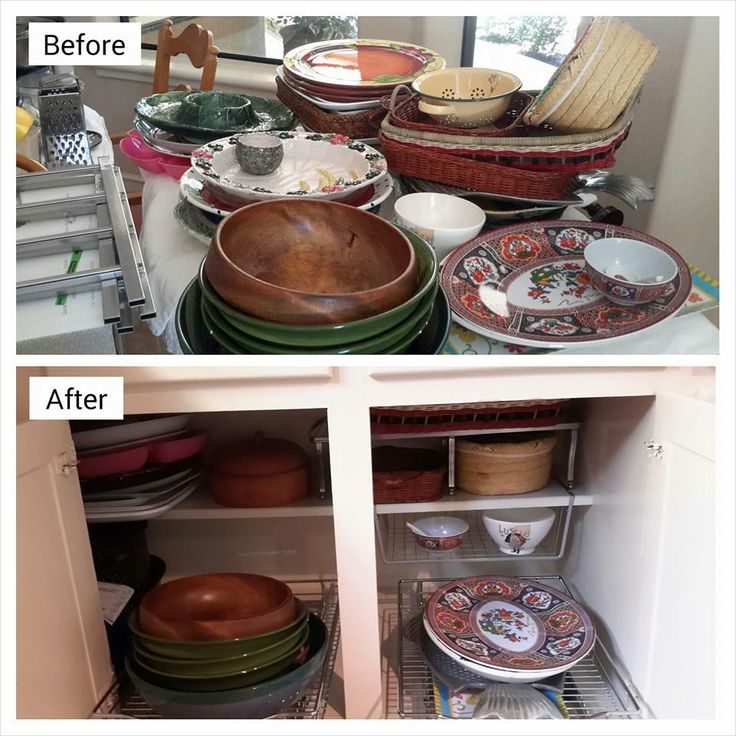
You are a GUI agent. You are given a task and a screenshot of the screen. Output one action in this format:
    pyautogui.click(x=<x>, y=<y>)
    Task: Click on the bowls
    The width and height of the screenshot is (736, 736).
    Given the screenshot: What is the action you would take?
    pyautogui.click(x=343, y=250), pyautogui.click(x=424, y=207), pyautogui.click(x=620, y=288), pyautogui.click(x=484, y=102), pyautogui.click(x=261, y=149), pyautogui.click(x=235, y=113)